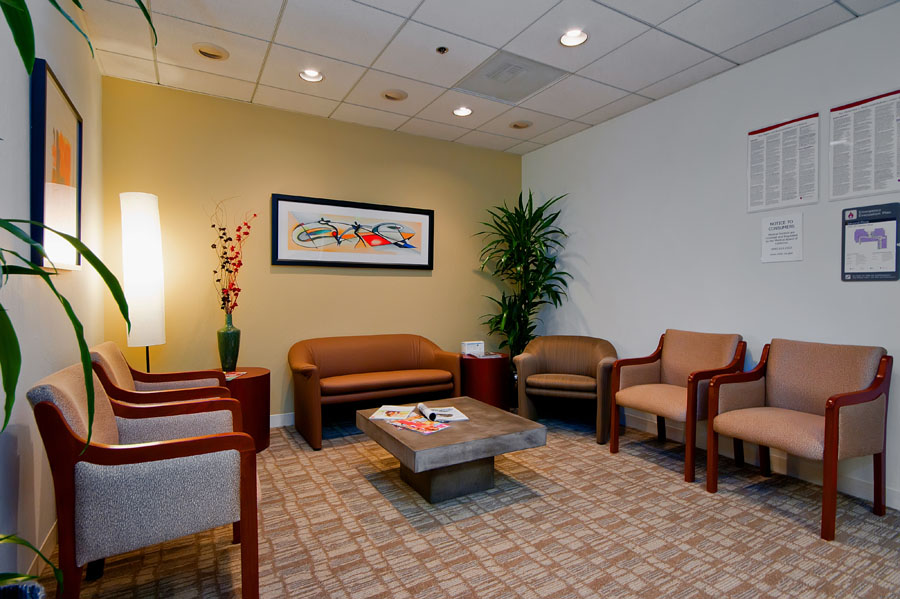
At what (x,y) coordinates should I click in order to perform the action: click on plant. Please return your answer as a coordinate pair (x, y). The width and height of the screenshot is (900, 599). Looking at the image, I should click on (7, 360).